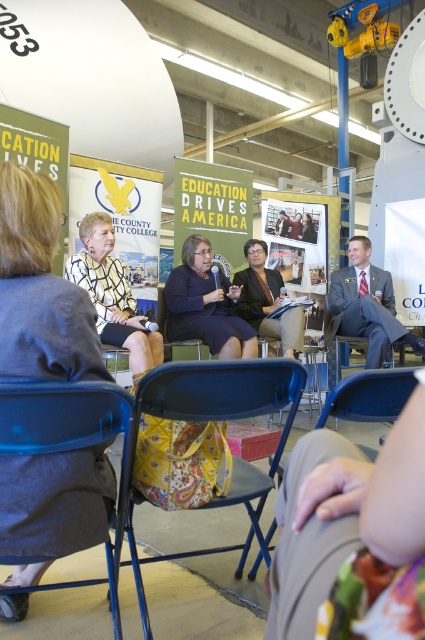
Question: Can you confirm if matte black dress at center is smaller than matte black jacket at center?

Choices:
 (A) no
 (B) yes

Answer: (A)

Question: Is blue fabric chair at lower left thinner than matte black dress at center?

Choices:
 (A) yes
 (B) no

Answer: (A)

Question: Which object is the closest to the matte black dress at center?

Choices:
 (A) blue fabric chair at center
 (B) blue metal chair at center
 (C) blue fabric chair at lower left
 (D) patterned fabric dress at center

Answer: (B)

Question: Which object is positioned farthest from the blue fabric chair at center?

Choices:
 (A) patterned fabric dress at center
 (B) blue fabric chair at lower left
 (C) patterned fabric skirt at center
 (D) matte black jacket at center

Answer: (D)

Question: Which object is positioned farthest from the blue fabric chair at center?

Choices:
 (A) blue metal chair at center
 (B) matte black jacket at center
 (C) patterned fabric dress at center
 (D) patterned fabric skirt at center

Answer: (B)

Question: Is blue metal chair at center wider than matte black dress at center?

Choices:
 (A) no
 (B) yes

Answer: (A)